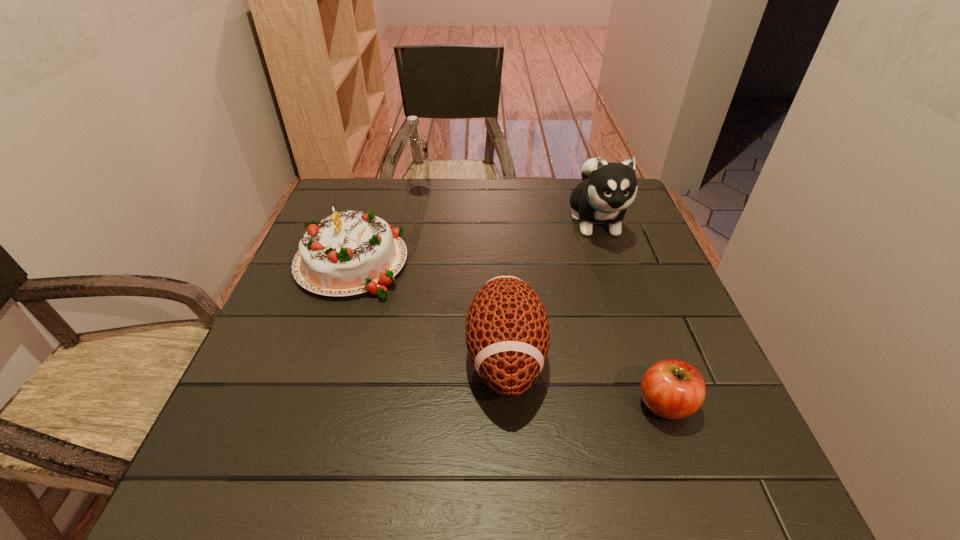
This screenshot has height=540, width=960. What are the coordinates of `vodka` in the screenshot? It's located at (415, 147).

This screenshot has width=960, height=540. Find the location of `puppy`. puppy is located at coordinates (607, 189).

At what (x,y) coordinates should I click in order to perform the action: click on the third object from right to left. Please return your answer as a coordinate pair (x, y). The height and width of the screenshot is (540, 960). Looking at the image, I should click on (507, 331).

Where is `cake`? cake is located at coordinates (348, 253).

The image size is (960, 540). In order to click on apple in this screenshot , I will do `click(672, 389)`.

Where is `vacant space located 0.400m on the front label of the vodka`? vacant space located 0.400m on the front label of the vodka is located at coordinates (563, 191).

Locate an element on the screen. Image resolution: width=960 pixels, height=540 pixels. vacant space located at the face of the puppy is located at coordinates (642, 356).

The image size is (960, 540). Identify the location of free space located on the back of the football. (498, 223).

In order to click on vacant space located 0.150m on the front of the cake in this screenshot , I will do `click(320, 355)`.

Image resolution: width=960 pixels, height=540 pixels. Find the location of `vacant space located 0.170m on the left of the apple`. vacant space located 0.170m on the left of the apple is located at coordinates (542, 403).